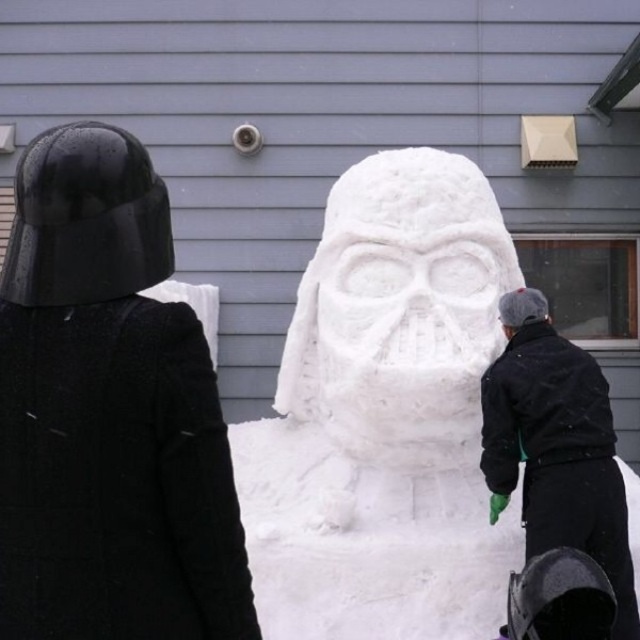
You are standing at the camera position and want to know how far the point at coordinates (392, 499) is from you. Can you determine the distance?

The distance of point (392, 499) from the camera is 10.07 meters.

Based on the scene description, which object is bigger between the white fluffy snowman at center and the black matte jacket at lower right?

The white fluffy snowman at center is larger than the black matte jacket at lower right according to the description.

You are standing in the snow and see the white fluffy snowman at center and the black matte jacket at lower right. Which object is closer to you?

The white fluffy snowman at center is positioned over the black matte jacket at lower right, so the white fluffy snowman at center is closer to you.